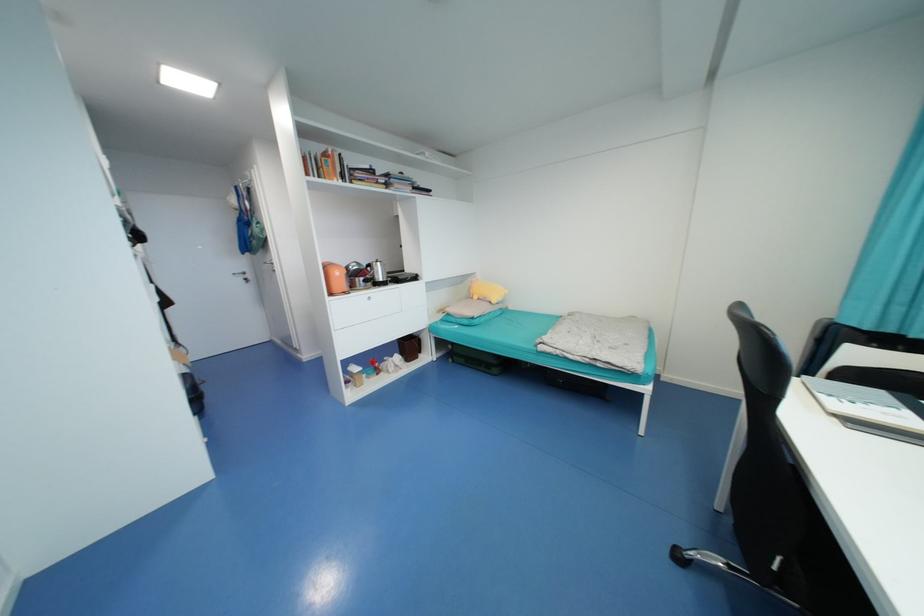
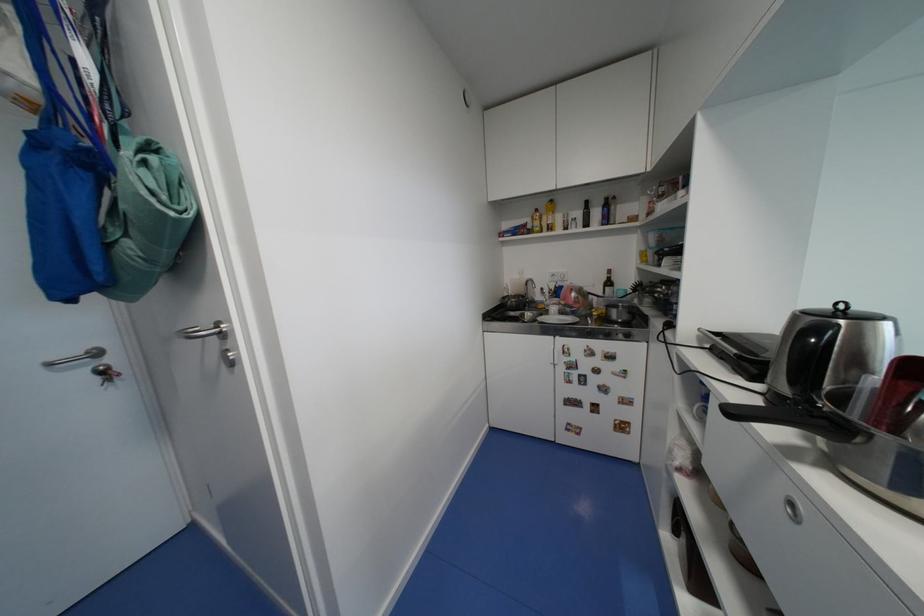
Based on the photo, what movement of the cameraman would produce the second image?

The cameraman walked toward left, forward.